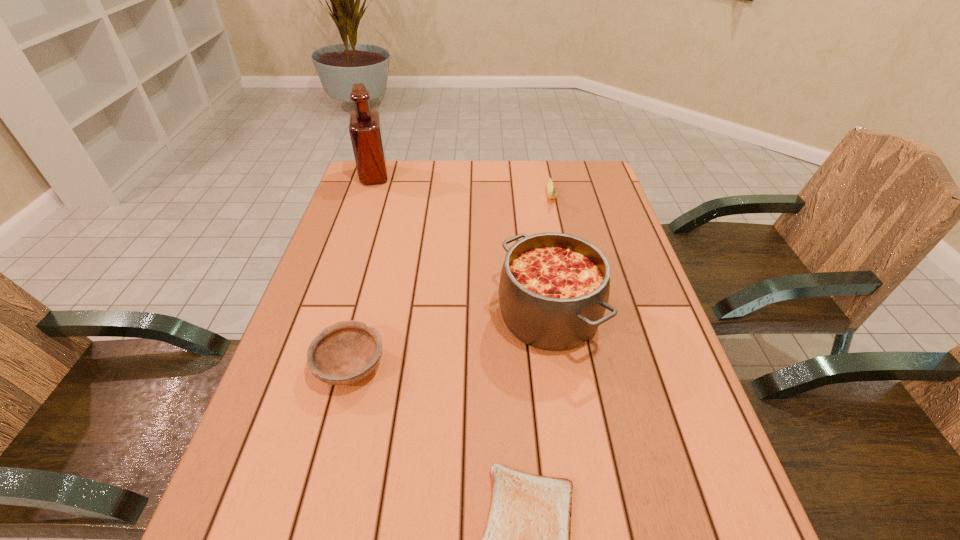
Locate an element on the screen. This screenshot has width=960, height=540. liquor at the left edge is located at coordinates (365, 130).

Where is `bowl located at the left edge`? bowl located at the left edge is located at coordinates (346, 352).

Locate an element on the screen. This screenshot has height=540, width=960. object at the right edge is located at coordinates (554, 288).

Locate an element on the screen. The height and width of the screenshot is (540, 960). object at the far left corner is located at coordinates (365, 130).

The height and width of the screenshot is (540, 960). What are the coordinates of `vacant area at the far edge` in the screenshot? It's located at (488, 186).

Where is `blank space at the left edge`? This screenshot has width=960, height=540. blank space at the left edge is located at coordinates (292, 388).

In the image, there is a desktop. Identify the location of free space at the right edge. Image resolution: width=960 pixels, height=540 pixels. (674, 349).

At what (x,y) coordinates should I click in order to perform the action: click on free space that is in between the liquor and the bowl. Please return your answer as a coordinate pair (x, y). The width and height of the screenshot is (960, 540). Looking at the image, I should click on (362, 271).

Identify the location of empty location between the banana and the tallest object. tap(463, 186).

This screenshot has width=960, height=540. I want to click on unoccupied position between the tallest object and the bowl, so click(x=362, y=271).